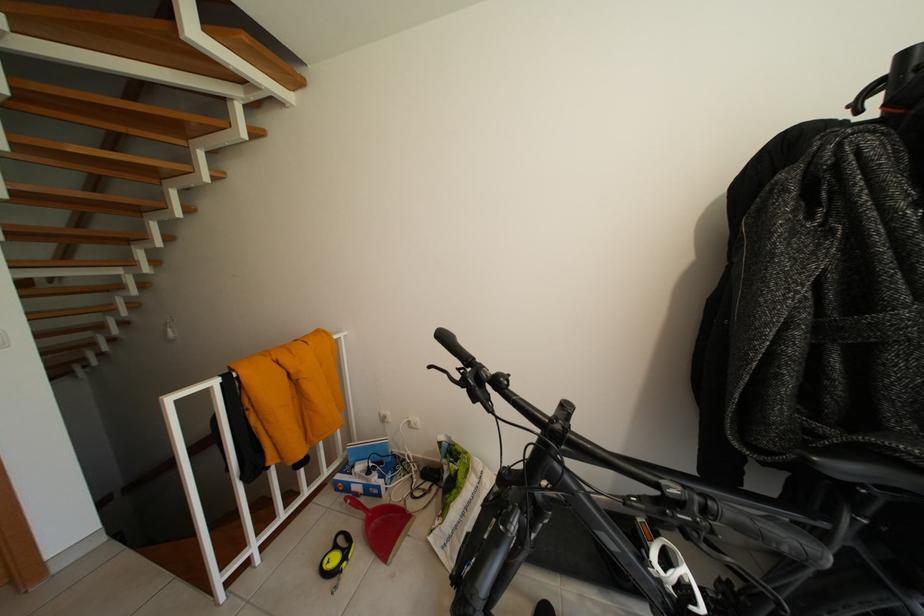
Find where to sit the bicycle saddle. Please return your answer as a coordinate pair (x, y).

(868, 460)